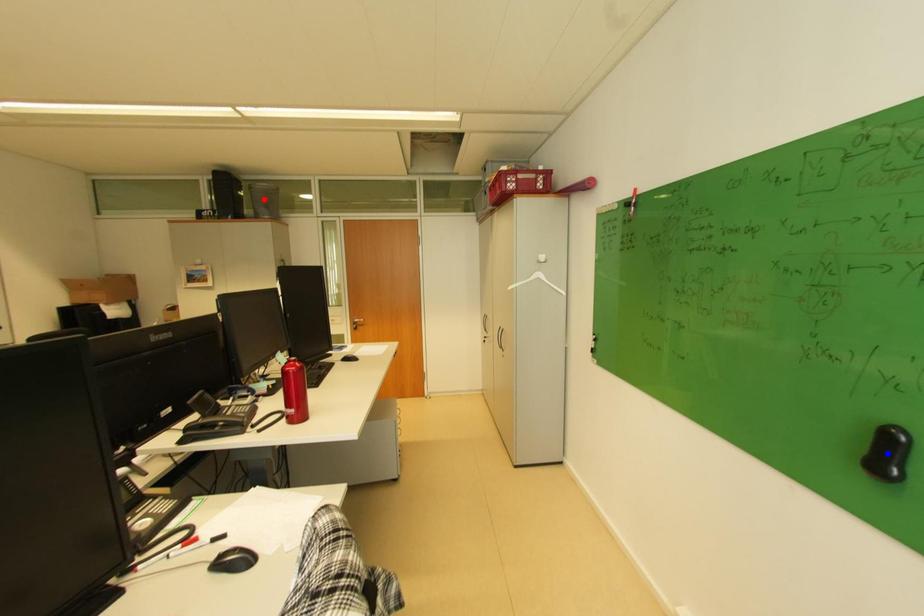
Question: In the image, two points are highlighted. Which point is nearer to the camera? Reply with the corresponding letter.

Choices:
 (A) blue point
 (B) red point

Answer: (A)